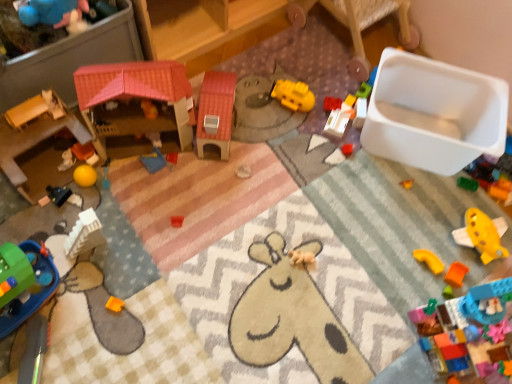
The height and width of the screenshot is (384, 512). I want to click on vacant space in between yellow matte plastic arch at lower right, acting as the 4th toy starting from the right, and plastic pink house at center, the 7th toy in the left-to-right sequence, so click(x=281, y=194).